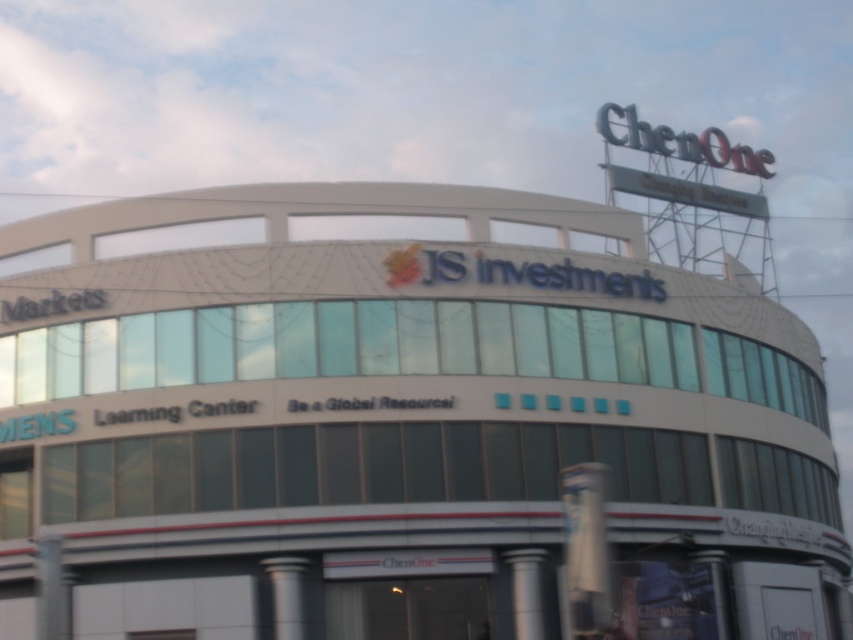
You are a delivery person standing at the entrance of the white glass building at center. You need to place a package at the silver metallic pillar at lower center. Can you walk directly to the pillar without any obstacles? The path between them is 11.42 meters long. Since there are no mentioned obstacles in the scene description, you can proceed directly.

Yes, you can walk directly to the silver metallic pillar at lower center from the white glass building at center since the distance is 11.42 meters and there are no mentioned obstacles in the scene description.

You are standing in front of the modern building and want to enter through the entrance. Which object, the white glass building at center or the silver metallic pillar at center, is directly above the entrance?

The white glass building at center is positioned over the silver metallic pillar at center, so the entrance is under the silver metallic pillar at center.

You are a visitor approaching the entrance of the building and see the silver metallic pillar at center and the silver metallic pillar at lower center. Which pillar should you walk around to get to the entrance?

The silver metallic pillar at center has a larger size compared to silver metallic pillar at lower center, so you should walk around the silver metallic pillar at lower center to get to the entrance since it is smaller and closer to the entrance.